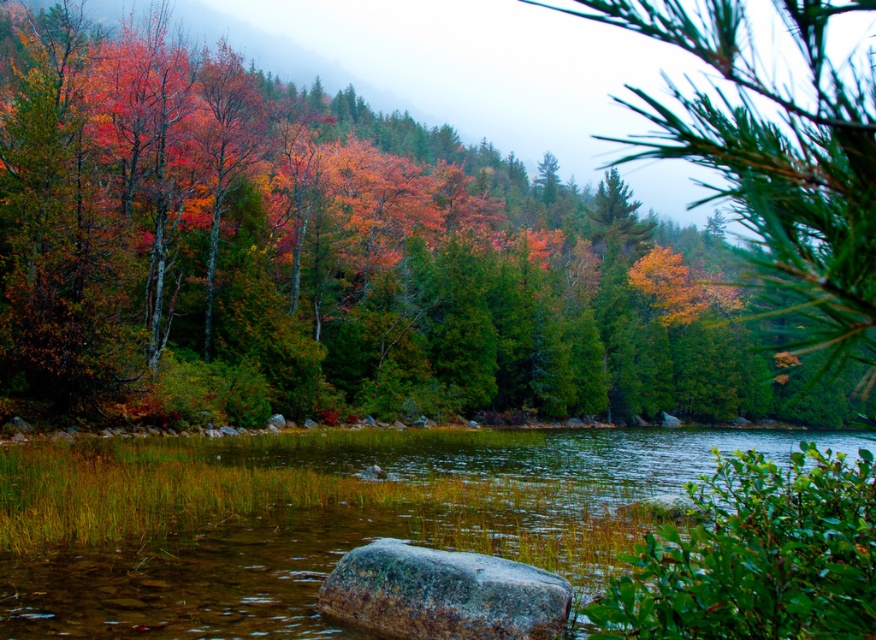
You are an artist trying to paint this autumn scene. You want to ensure the autumn leaves at center and clear water at center are proportionally accurate. Which object should you paint wider in your artwork?

The autumn leaves at center should be painted wider than the clear water at center because the autumn leaves at center has a larger width according to the description.

You are a photographer planning to capture the reflection of the gray textured rock at center in the clear water at center. Based on the scene description, can you confirm if the reflection will be visible?

The clear water at center is positioned under the gray textured rock at center, so the reflection of the gray textured rock at center should be visible in the clear water at center.

You are standing at the edge of the lake and want to take a photo of the gray textured rock at center and the clear water at center. Which object should you focus on first if you want to capture both in sharp detail?

You should focus on the gray textured rock at center first because it is closer to you than the clear water at center, which is further away.